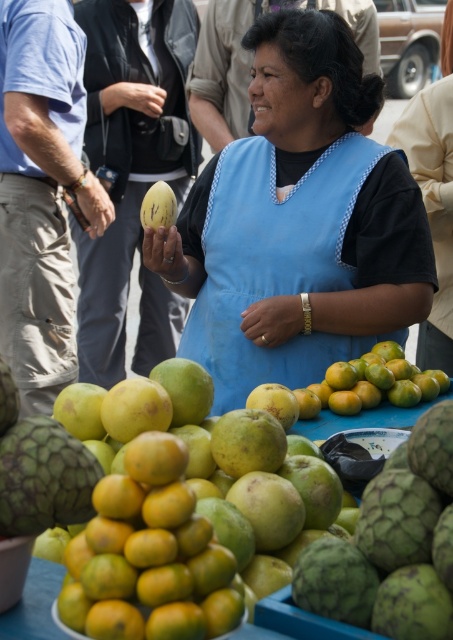
Is smooth orange tangerine at lower left taller than green matte melon at center?

Yes.

Image resolution: width=453 pixels, height=640 pixels. Describe the element at coordinates (149, 556) in the screenshot. I see `smooth orange tangerine at lower left` at that location.

The image size is (453, 640). I want to click on smooth orange tangerine at lower left, so click(149, 556).

You are a GUI agent. You are given a task and a screenshot of the screen. Output one action in this format:
    pyautogui.click(x=<x>, y=<y>)
    Task: Click on the smooth orange tangerine at lower left
    The image size is (453, 640).
    Given the screenshot: What is the action you would take?
    pyautogui.click(x=149, y=556)

The width and height of the screenshot is (453, 640). What do you see at coordinates (298, 221) in the screenshot?
I see `blue fabric dress at center` at bounding box center [298, 221].

Who is more forward, (x=207, y=248) or (x=123, y=636)?

Point (x=123, y=636) is in front.

What do you see at coordinates (298, 221) in the screenshot? I see `blue fabric dress at center` at bounding box center [298, 221].

What are the coordinates of `blue fabric dress at center` in the screenshot? It's located at (298, 221).

Does blue fabric dress at center appear over smooth orange tangerine at lower left?

Yes.

Consider the image. Between blue fabric dress at center and smooth orange tangerine at lower left, which one appears on the right side from the viewer's perspective?

From the viewer's perspective, blue fabric dress at center appears more on the right side.

Is point (201, 314) positioned behind point (163, 451)?

That is True.

Where is `blue fabric dress at center`? Image resolution: width=453 pixels, height=640 pixels. blue fabric dress at center is located at coordinates (298, 221).